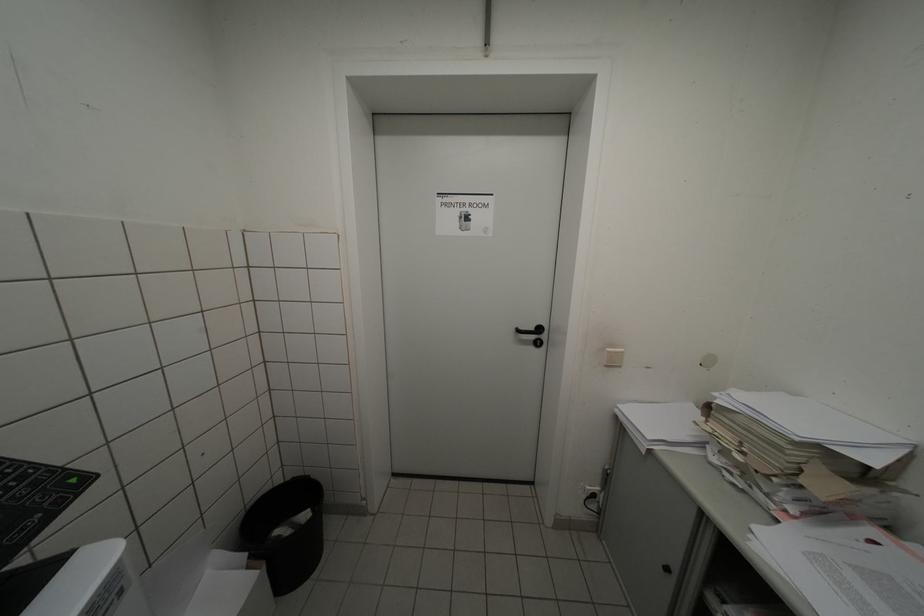
Where would you push the beige light switch? Please return your answer as a coordinate pair (x, y).

(614, 357)